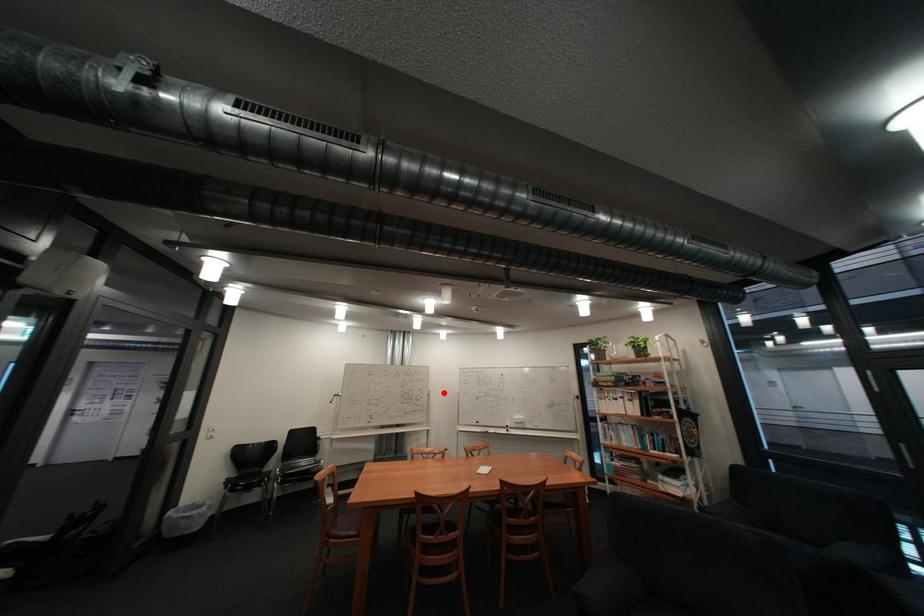
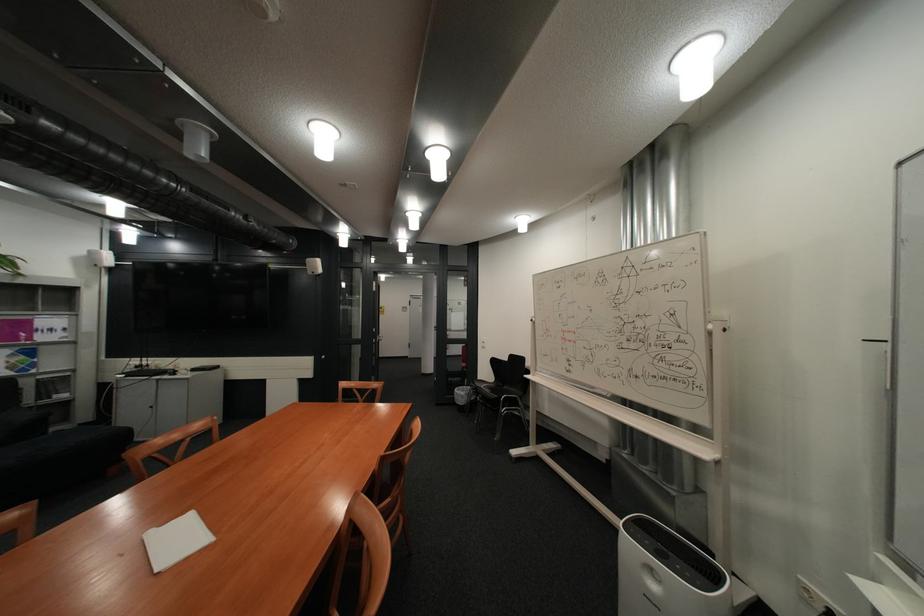
Question: I am providing you with two images of the same scene from different viewpoints. Given a red point in image1, look at the same physical point in image2. Is it:

Choices:
 (A) Closer to the viewpoint
 (B) Farther from the viewpoint

Answer: (A)